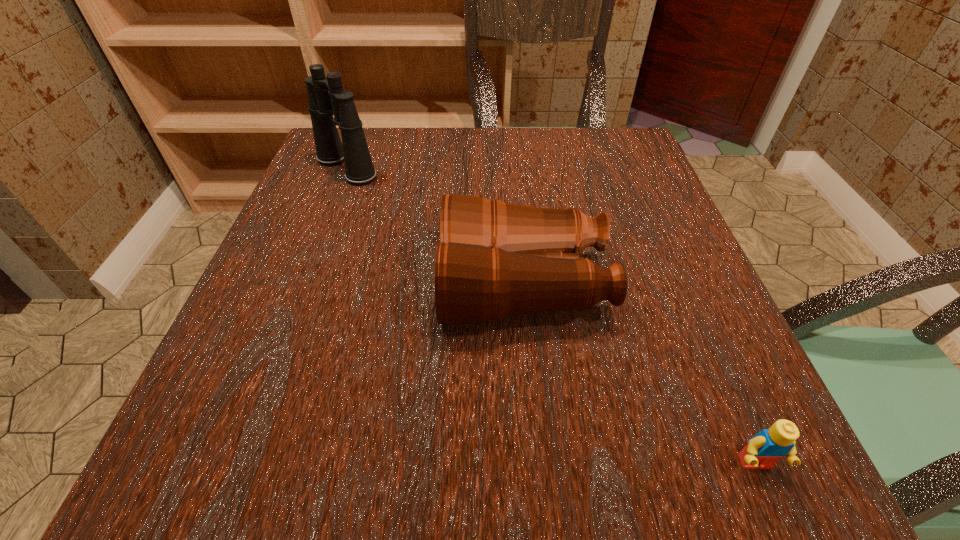
Find the location of a particular element. The image size is (960, 540). object present at the far edge is located at coordinates (326, 96).

Image resolution: width=960 pixels, height=540 pixels. Find the location of `object that is at the near edge`. object that is at the near edge is located at coordinates (763, 450).

Identify the location of object present at the left edge. The image size is (960, 540). (326, 96).

The height and width of the screenshot is (540, 960). I want to click on object at the right edge, so click(x=763, y=450).

Identify the location of object located in the far left corner section of the desktop. Image resolution: width=960 pixels, height=540 pixels. (326, 96).

Identify the location of object located at the near right corner. (763, 450).

Where is `free space at the far edge of the desktop`? The image size is (960, 540). free space at the far edge of the desktop is located at coordinates (562, 146).

You are a GUI agent. You are given a task and a screenshot of the screen. Output one action in this format:
    pyautogui.click(x=<x>, y=<y>)
    Task: Click on the free space at the left edge
    This screenshot has height=540, width=960.
    Given the screenshot: What is the action you would take?
    pyautogui.click(x=330, y=223)

This screenshot has width=960, height=540. What are the coordinates of `free space at the right edge of the desktop` in the screenshot? It's located at (622, 186).

At what (x,y) coordinates should I click in order to perform the action: click on vacant space at the far left corner of the desktop. Please return your answer as a coordinate pair (x, y). Image resolution: width=960 pixels, height=540 pixels. Looking at the image, I should click on (380, 126).